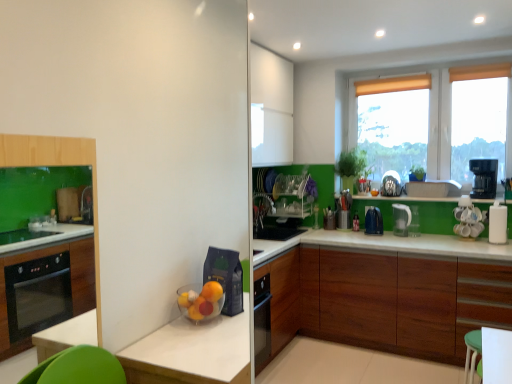
Question: From the image's perspective, relative to metallic silver utensil holder at center-right, the fourth appliance positioned from the right, is clear plastic pitcher at upper right, which is the 2th kitchen appliance from left to right, above or below?

Choices:
 (A) below
 (B) above

Answer: (A)

Question: Considering the positions of clear plastic pitcher at upper right, which is the 2th kitchen appliance from left to right, and metallic silver utensil holder at center-right, marked as the 4th appliance in a front-to-back arrangement, in the image, is clear plastic pitcher at upper right, which is the 2th kitchen appliance from left to right, bigger or smaller than metallic silver utensil holder at center-right, marked as the 4th appliance in a front-to-back arrangement,?

Choices:
 (A) small
 (B) big

Answer: (A)

Question: Which object is positioned closest to the white glossy coffee maker at right, the 3th appliance positioned from the left?

Choices:
 (A) wooden cabinet at lower right
 (B) white glossy table at lower right
 (C) satin silver kettle at upper right, which is the second appliance from back to front
 (D) black plastic coffee maker at upper right, the third kitchen appliance from the left
 (E) clear plastic pitcher at upper right, which is the 2th kitchen appliance from left to right

Answer: (D)

Question: Which object is the farthest from the satin silver kettle at upper right, which is the second appliance from back to front?

Choices:
 (A) white glossy table at lower right
 (B) white glossy paper towel dispenser at right, the fourth appliance viewed from the back
 (C) black plastic coffee maker at upper right, the third kitchen appliance from the left
 (D) clear plastic pitcher at upper right, the second kitchen appliance when ordered from right to left
 (E) metallic silver utensil holder at center-right, the fourth appliance positioned from the right

Answer: (A)